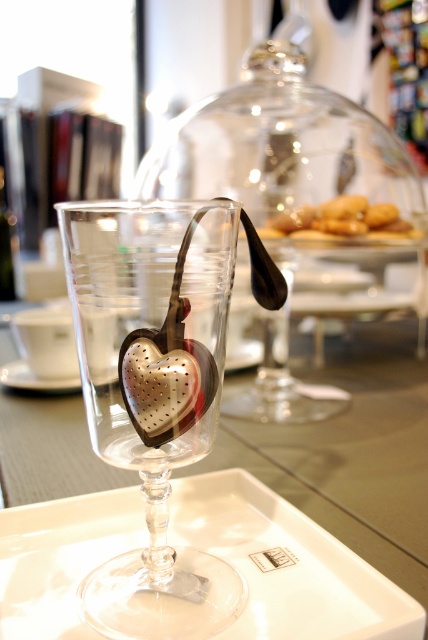
Looking at this image, you are placing a white glossy tray at center on a table. Where should you place it to ensure it aligns with the coordinate system of the table?

The white glossy tray at center should be placed at point coordinates (287, 564) to align with the table coordinate system.

You are a delivery robot positioned at the center of the image. You need to pick up an object located at point (231, 540) and deliver it to a drop zone at point (193, 365). Since both points are in the image, will you have to move forward or backward to reach the drop zone after picking up the object?

Since point (231, 540) is further to the viewer than point (193, 365), you will need to move forward to reach the drop zone at (193, 365) after picking up the object at (231, 540).